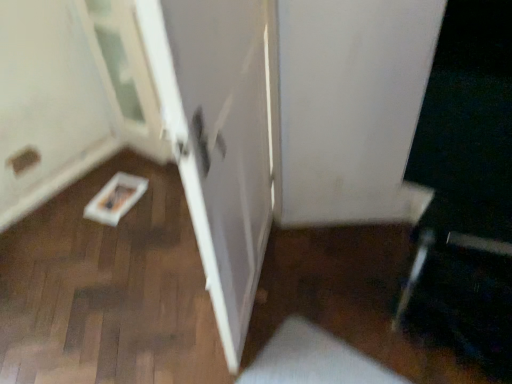
Locate an element on the screen. vacant area to the right of white glossy door at center is located at coordinates (327, 279).